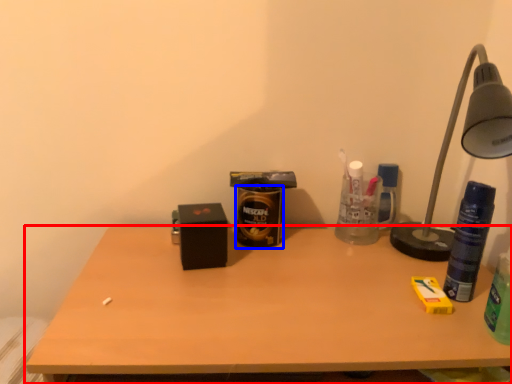
Question: Which point is further to the camera, desk (highlighted by a red box) or beverage (highlighted by a blue box)?

Choices:
 (A) desk
 (B) beverage

Answer: (B)